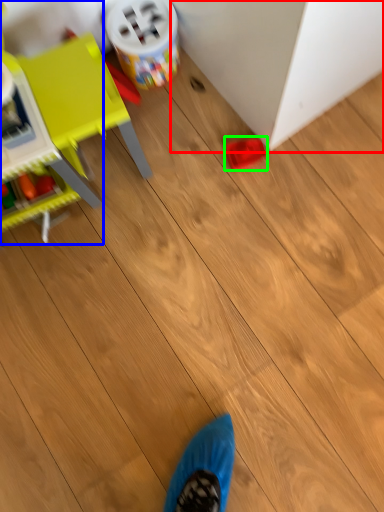
Question: Which object is positioned closest to furniture (highlighted by a red box)? Select from toy (highlighted by a blue box) and toy (highlighted by a green box).

Choices:
 (A) toy
 (B) toy

Answer: (B)